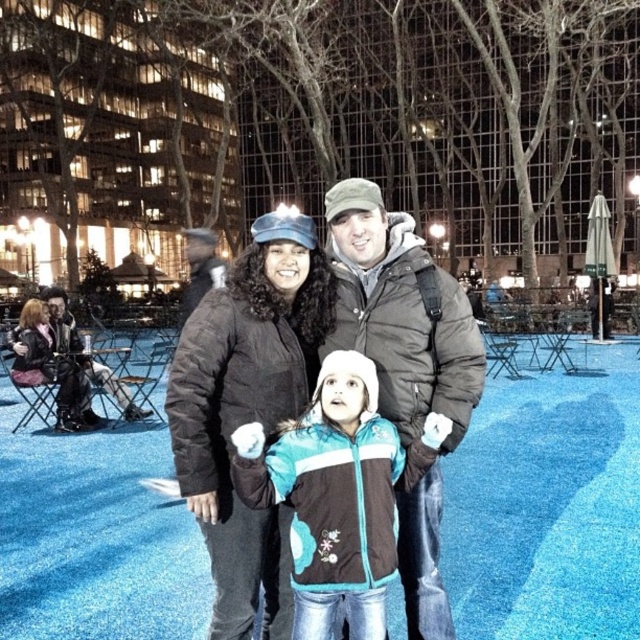
At what (x,y) coordinates should I click in order to perform the action: click on dark brown puffy coat at center. Please return your answer as a coordinate pair (x, y). Looking at the image, I should click on (401, 314).

Who is shorter, dark brown puffy coat at center or teal and white jacket at center?

With less height is teal and white jacket at center.

Where is `dark brown puffy coat at center`? dark brown puffy coat at center is located at coordinates (401, 314).

Locate an element on the screen. dark brown puffy coat at center is located at coordinates (401, 314).

Is the position of dark brown puffy coat at center less distant than that of leather jacket at left?

Yes.

Who is more distant from viewer, (420, 264) or (35, 339)?

The point (35, 339) is more distant.

Is point (355, 202) more distant than point (74, 401)?

No.

What are the coordinates of `dark brown puffy coat at center` in the screenshot? It's located at (401, 314).

Who is lower down, black puffy coat at center or dark brown puffy coat at center?

Positioned lower is black puffy coat at center.

You are a GUI agent. You are given a task and a screenshot of the screen. Output one action in this format:
    pyautogui.click(x=<x>, y=<y>)
    Task: Click on the black puffy coat at center
    The image size is (640, 640).
    Given the screenshot: What is the action you would take?
    pyautogui.click(x=248, y=406)

Identify the location of black puffy coat at center. The height and width of the screenshot is (640, 640). (248, 406).